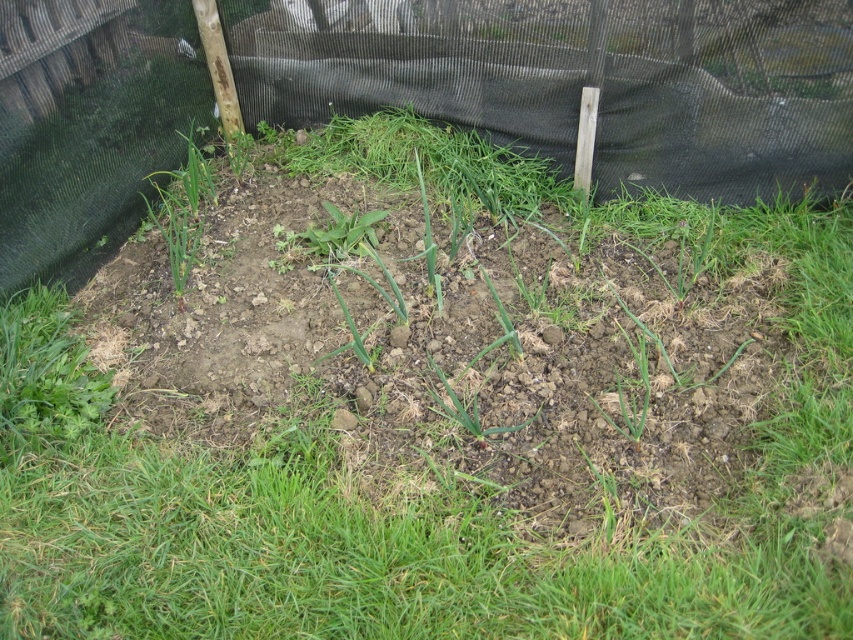
You are a gardener who wants to install a new sprinkler system. You need to know if the black mesh fence at upper center is positioned above the green grass at upper left to avoid damaging the grass roots. Can you confirm the spatial relationship between them?

The black mesh fence at upper center is located above the green grass at upper left, so installing the sprinkler system should avoid damaging the grass roots by ensuring the fence is positioned over the grass.

You are standing in the garden and want to walk from the green grass at upper left to the black mesh fence at upper center. Which direction should you move?

You should move to the right to reach the black mesh fence at upper center from the green grass at upper left since it is located to the right of the grass.

You are a gardener who wants to install a new fence that is the same height as the existing black mesh fence at upper center. You have a patch of green grass at upper left that is currently 10 cm tall. What minimum height should your new fence be to match the existing one?

The black mesh fence at upper center is taller than green grass at upper left, which is 10 cm tall. Therefore, the new fence must be taller than 10 cm to match the existing black mesh fence at upper center.